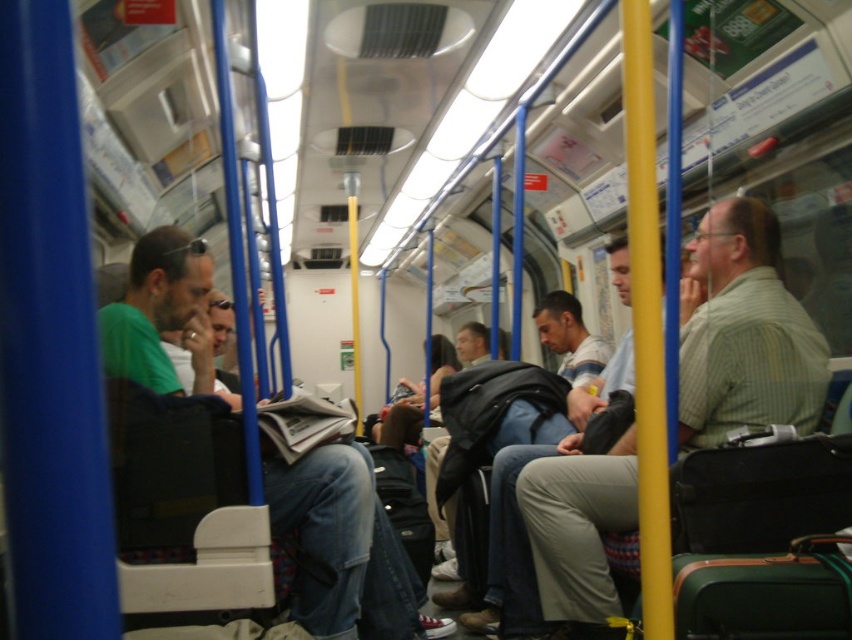
You are sitting in the public transportation vehicle and want to reach the overhead luggage rack. You notice the light green striped shirt at right and the dark blue jeans at center. Which of these two items is closer to your right side?

The light green striped shirt at right is closer to your right side as it is positioned to the right of the dark blue jeans at center.

You are a passenger on the train and need to reach the overhead luggage rack. You see a light green striped shirt at right and a light gray pants at center. Which clothing item is closer to the ceiling?

The light green striped shirt at right is shorter than the light gray pants at center, so the light gray pants at center is taller and closer to the ceiling.

You are standing in the train car and need to pass between the light green striped shirt at right and the dark blue jeans at center. Can you estimate if there is enough space for you to walk through without touching either?

The light green striped shirt at right might be wider than dark blue jeans at center, so there may not be enough space to walk through safely without touching either object. It is advisable to wait for a less crowded moment or choose a different path.